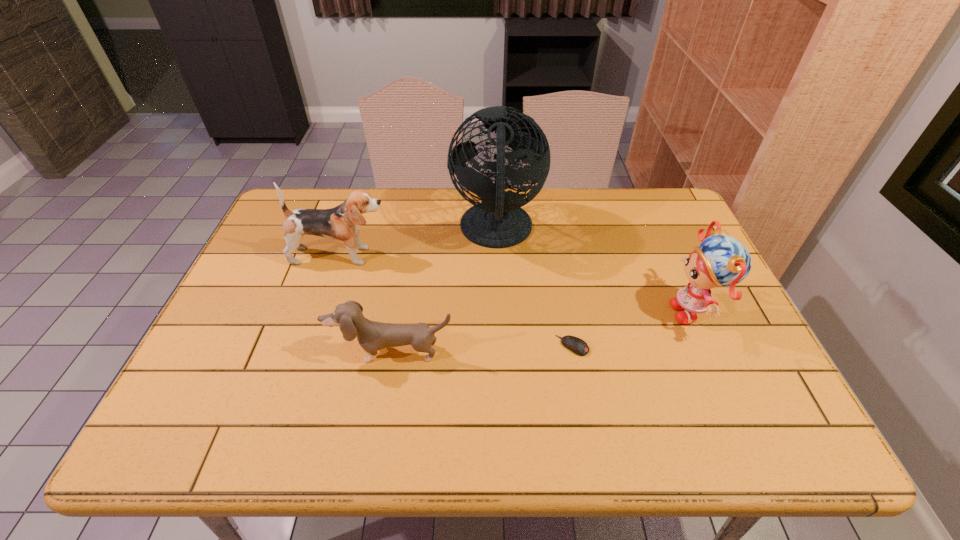
Identify the location of free location that satisfies the following two spatial constraints: 1. on the front-facing side of the tallest object; 2. on the right side of the shortest object. This screenshot has width=960, height=540. (501, 346).